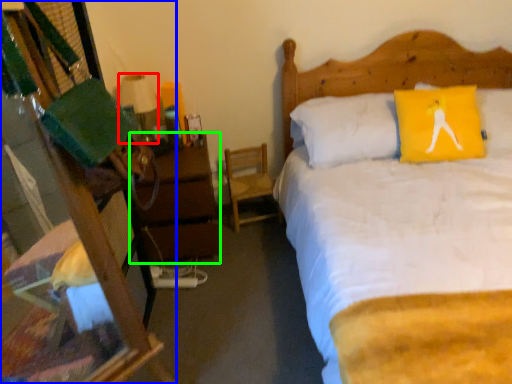
Question: Which object is the closest to the lamp (highlighted by a red box)? Choose among these: desk (highlighted by a blue box) or nightstand (highlighted by a green box).

Choices:
 (A) desk
 (B) nightstand

Answer: (B)